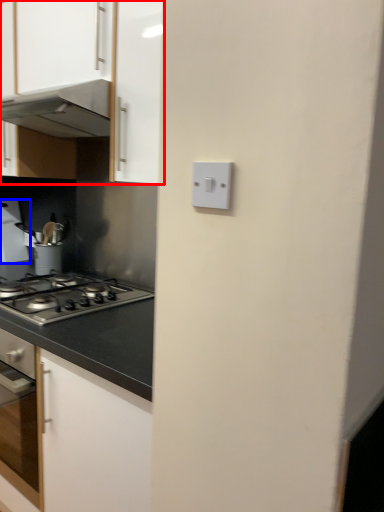
Question: Which point is further to the camera, cabinetry (highlighted by a red box) or kitchen appliance (highlighted by a blue box)?

Choices:
 (A) cabinetry
 (B) kitchen appliance

Answer: (B)